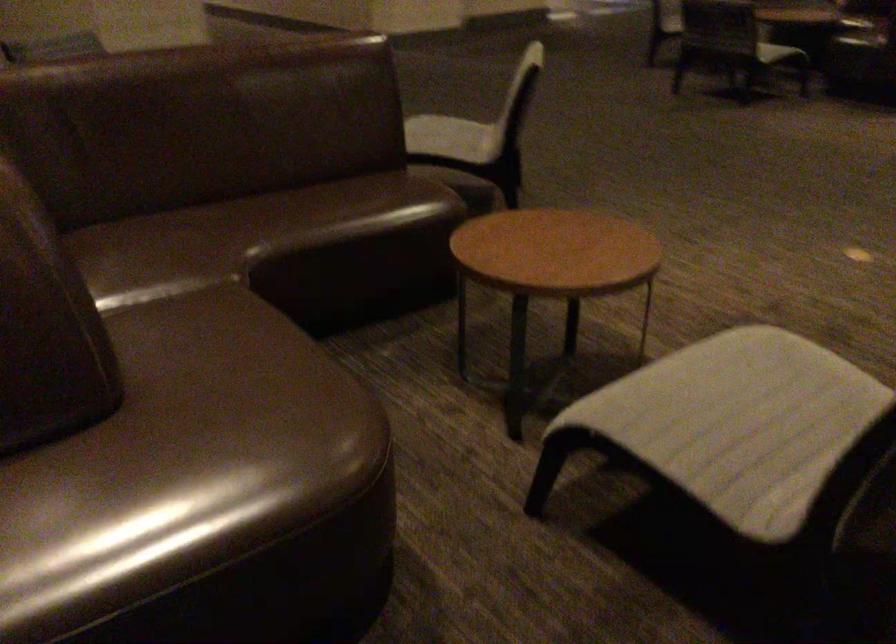
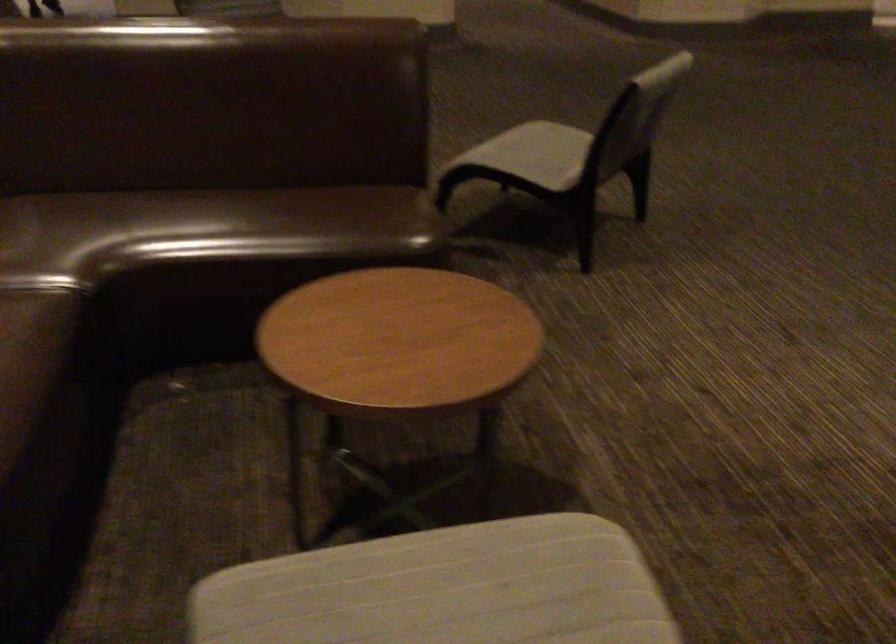
Find the pixel in the second image that matches point (461, 136) in the first image.

(533, 154)